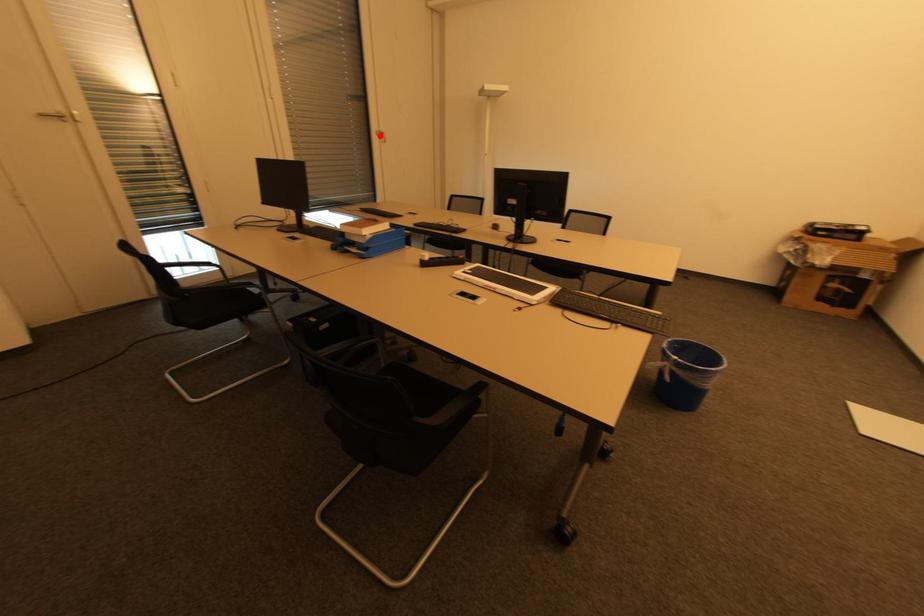
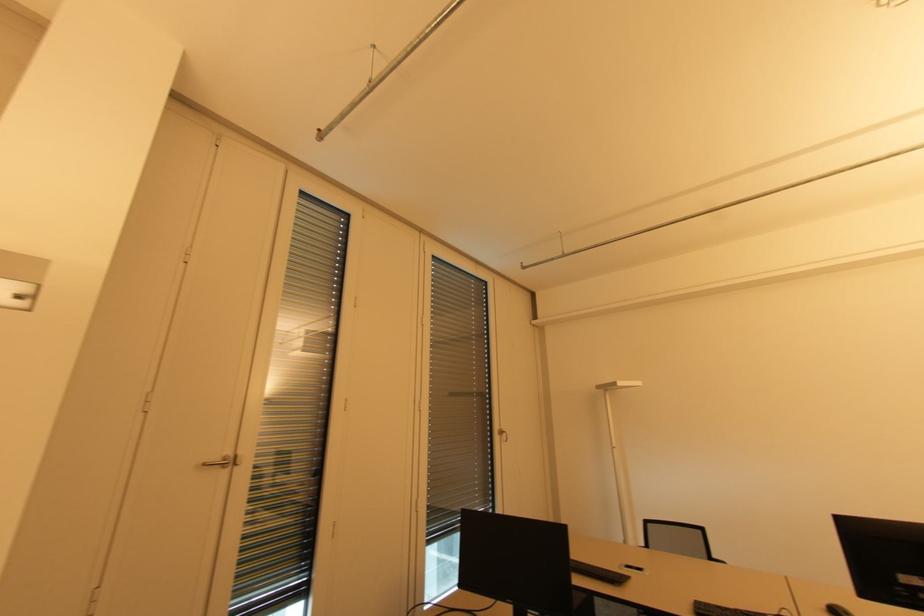
Where in the second image is the point corresponding to the highlighted location from the first image?

(501, 435)